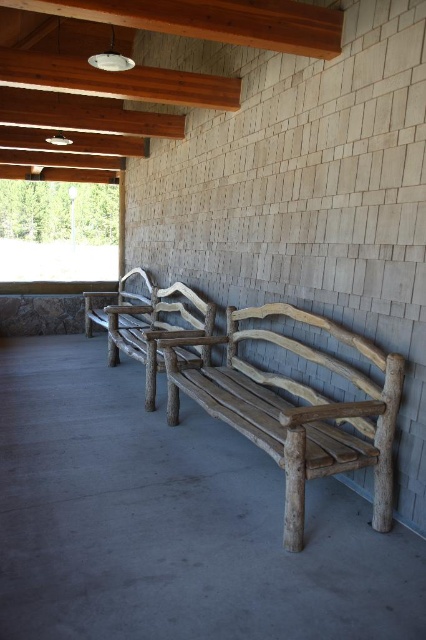
Locate an element on the screen. The width and height of the screenshot is (426, 640). weathered wood bench at center is located at coordinates (296, 408).

How much distance is there between weathered wood bench at center and natural wood bench at center?

The distance of weathered wood bench at center from natural wood bench at center is 4.49 feet.

Which is in front, point (268, 444) or point (172, 333)?

Point (268, 444) is more forward.

The image size is (426, 640). I want to click on weathered wood bench at center, so click(x=296, y=408).

Measure the distance between gray concrete bench at center and camera.

The distance of gray concrete bench at center from camera is 6.23 feet.

Does gray concrete bench at center appear on the right side of weathered wood bench at center?

In fact, gray concrete bench at center is to the left of weathered wood bench at center.

Is point (95, 374) positioned behind point (278, 385)?

Yes.

The image size is (426, 640). I want to click on gray concrete bench at center, so click(x=172, y=522).

Does natural wood bench at center have a smaller size compared to rustic wood bench at center?

Yes, natural wood bench at center is smaller than rustic wood bench at center.

You are a GUI agent. You are given a task and a screenshot of the screen. Output one action in this format:
    pyautogui.click(x=<x>, y=<y>)
    Task: Click on the natural wood bench at center
    
    Given the screenshot: What is the action you would take?
    (155, 328)